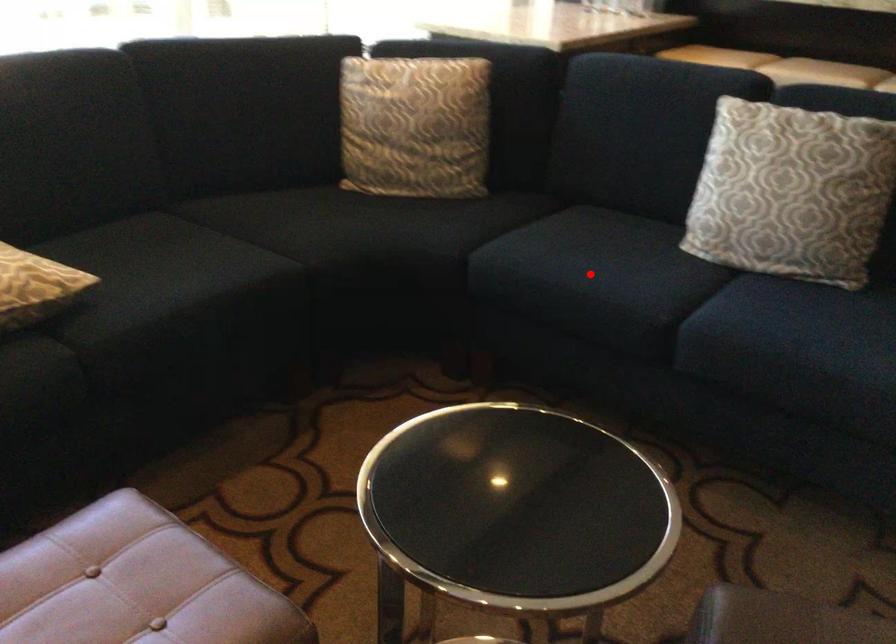
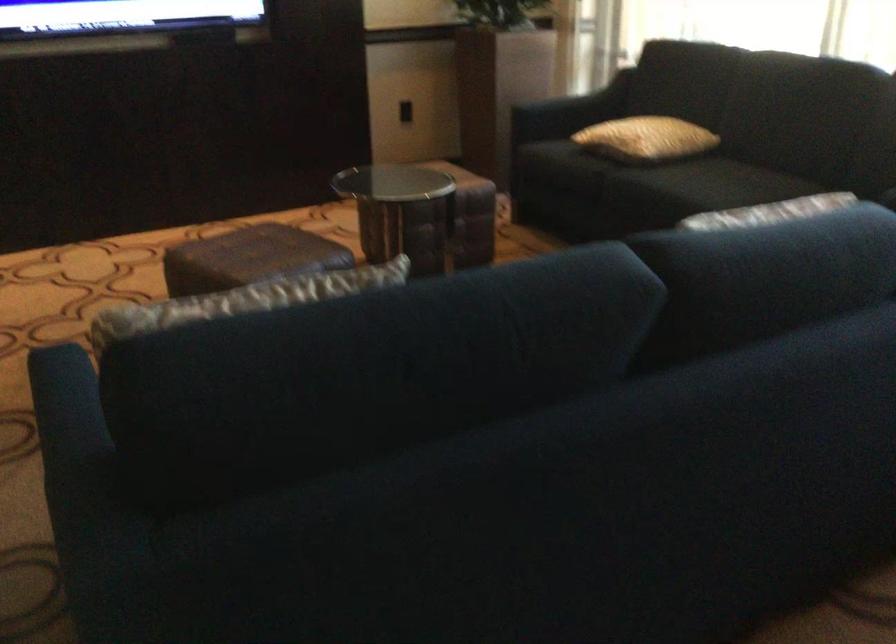
Question: I am providing you with two images of the same scene from different viewpoints. A red point is marked on the first image. Is the red point's position out of view in image 2?

Choices:
 (A) Yes
 (B) No

Answer: (A)